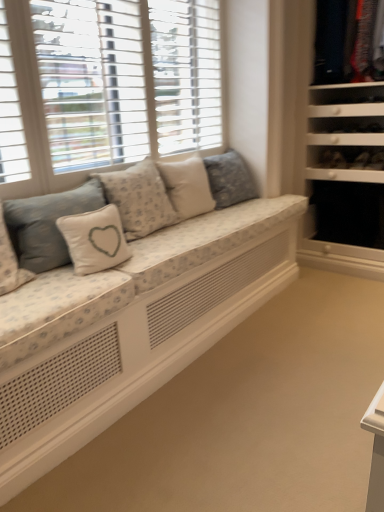
Describe the element at coordinates (139, 198) in the screenshot. Image resolution: width=384 pixels, height=512 pixels. I see `white fabric pillow at center, positioned as the 3th pillow in left-to-right order` at that location.

What do you see at coordinates (187, 186) in the screenshot?
I see `white fabric pillow at center, positioned as the fourth pillow in left-to-right order` at bounding box center [187, 186].

Where is `white textured shutters at upper left`? This screenshot has height=512, width=384. white textured shutters at upper left is located at coordinates (104, 87).

Image resolution: width=384 pixels, height=512 pixels. I want to click on fluffy white pillow at center, which is the first pillow from right to left, so click(x=229, y=179).

The height and width of the screenshot is (512, 384). Describe the element at coordinates (229, 179) in the screenshot. I see `fluffy white pillow at center, which is the first pillow from right to left` at that location.

This screenshot has height=512, width=384. I want to click on white fabric pillow with heart design at center, which is the second pillow in left-to-right order, so 94,239.

Is white textured shutters at upper left facing away from white fabric pillow with heart design at center, which is the second pillow in left-to-right order?

No, white textured shutters at upper left is not facing the opposite direction of white fabric pillow with heart design at center, which is the second pillow in left-to-right order.

Considering the relative sizes of white textured shutters at upper left and white fabric pillow with heart design at center, the 4th pillow in the right-to-left sequence, in the image provided, is white textured shutters at upper left taller than white fabric pillow with heart design at center, the 4th pillow in the right-to-left sequence,?

Yes.

Image resolution: width=384 pixels, height=512 pixels. I want to click on the 5th pillow located beneath the white textured shutters at upper left (from a real-world perspective), so 94,239.

Which of these two, white textured shutters at upper left or white fabric pillow with heart design at center, which is the second pillow in left-to-right order, is bigger?

white textured shutters at upper left is bigger.

Between point (65, 236) and point (362, 237), which one is positioned behind?

The point (362, 237) is behind.

Considering the relative sizes of white fabric pillow with heart design at center, the 4th pillow in the right-to-left sequence, and black fabric drawer at right in the image provided, is white fabric pillow with heart design at center, the 4th pillow in the right-to-left sequence, smaller than black fabric drawer at right?

Yes, white fabric pillow with heart design at center, the 4th pillow in the right-to-left sequence, is smaller than black fabric drawer at right.

Which of these two, white fabric pillow with heart design at center, which is the second pillow in left-to-right order, or black fabric drawer at right, stands taller?

Standing taller between the two is black fabric drawer at right.

Is white fabric pillow with heart design at center, which is the second pillow in left-to-right order, positioned before black fabric drawer at right?

Yes, white fabric pillow with heart design at center, which is the second pillow in left-to-right order, is closer to the camera.

Considering the sizes of white fabric pillow at center, arranged as the second pillow when viewed from the right, and black fabric drawer at right in the image, is white fabric pillow at center, arranged as the second pillow when viewed from the right, taller or shorter than black fabric drawer at right?

Considering their sizes, white fabric pillow at center, arranged as the second pillow when viewed from the right, has less height than black fabric drawer at right.

Considering the positions of objects white fabric pillow at center, positioned as the fourth pillow in left-to-right order, and black fabric drawer at right in the image provided, who is more to the right, white fabric pillow at center, positioned as the fourth pillow in left-to-right order, or black fabric drawer at right?

black fabric drawer at right.

Considering the positions of objects white fabric pillow at center, positioned as the fourth pillow in left-to-right order, and black fabric drawer at right in the image provided, who is behind, white fabric pillow at center, positioned as the fourth pillow in left-to-right order, or black fabric drawer at right?

black fabric drawer at right is more distant.

From the image's perspective, would you say white fabric pillow at center, arranged as the second pillow when viewed from the right, is shown under black fabric drawer at right?

Incorrect, from the image's perspective, white fabric pillow at center, arranged as the second pillow when viewed from the right, is higher than black fabric drawer at right.

Is fluffy white pillow at center, which is the first pillow from right to left, situated inside floral fabric studio couch at center or outside?

fluffy white pillow at center, which is the first pillow from right to left, is spatially situated outside floral fabric studio couch at center.

Is floral fabric studio couch at center at the back of fluffy white pillow at center, which is the first pillow from right to left?

fluffy white pillow at center, which is the first pillow from right to left, is not turned away from floral fabric studio couch at center.

Who is smaller, fluffy white pillow at center, the fifth pillow viewed from the left, or floral fabric studio couch at center?

Smaller between the two is fluffy white pillow at center, the fifth pillow viewed from the left.

From the image's perspective, who appears lower, fluffy white pillow at center, the fifth pillow viewed from the left, or floral fabric studio couch at center?

From the image's view, floral fabric studio couch at center is below.

Is the position of white textured shutters at upper left more distant than that of floral fabric studio couch at center?

Yes, white textured shutters at upper left is further from the viewer.

Is white textured shutters at upper left directly adjacent to floral fabric studio couch at center?

No, white textured shutters at upper left is not touching floral fabric studio couch at center.

Which is nearer, (109, 151) or (88, 285)?

Clearly, point (109, 151) is more distant from the camera than point (88, 285).

How different are the orientations of fluffy white pillow at center, the fifth pillow viewed from the left, and white fabric pillow at center, arranged as the second pillow when viewed from the right, in degrees?

1.08 degrees separate the facing orientations of fluffy white pillow at center, the fifth pillow viewed from the left, and white fabric pillow at center, arranged as the second pillow when viewed from the right.

Looking at this image, considering the relative sizes of fluffy white pillow at center, the fifth pillow viewed from the left, and white fabric pillow at center, arranged as the second pillow when viewed from the right, in the image provided, is fluffy white pillow at center, the fifth pillow viewed from the left, wider than white fabric pillow at center, arranged as the second pillow when viewed from the right,?

Yes.

Consider the image. Is fluffy white pillow at center, the fifth pillow viewed from the left, not inside white fabric pillow at center, arranged as the second pillow when viewed from the right?

Absolutely, fluffy white pillow at center, the fifth pillow viewed from the left, is external to white fabric pillow at center, arranged as the second pillow when viewed from the right.

Is floral fabric studio couch at center in front of or behind fluffy white pillow at center, which is the first pillow from right to left, in the image?

In the image, floral fabric studio couch at center appears in front of fluffy white pillow at center, which is the first pillow from right to left.

Considering the relative positions of floral fabric studio couch at center and fluffy white pillow at center, the fifth pillow viewed from the left, in the image provided, is floral fabric studio couch at center to the right of fluffy white pillow at center, the fifth pillow viewed from the left, from the viewer's perspective?

Yes, floral fabric studio couch at center is to the right of fluffy white pillow at center, the fifth pillow viewed from the left.

From the image's perspective, starting from the floral fabric studio couch at center, which pillow is the 5th one above? Please provide its 2D coordinates.

[(229, 179)]

This screenshot has height=512, width=384. What are the coordinates of `the 5th pillow positioned below the white textured shutters at upper left (from the image's perspective)` in the screenshot? It's located at (94, 239).

I want to click on shelf on the right of white fabric pillow with heart design at center, the 4th pillow in the right-to-left sequence, so click(x=349, y=213).

Based on their spatial positions, is fluffy white pillow at center, the fifth pillow viewed from the left, or black fabric drawer at right closer to floral fabric studio couch at center?

Based on the image, fluffy white pillow at center, the fifth pillow viewed from the left, appears to be nearer to floral fabric studio couch at center.

Consider the image. When comparing their distances from white textured shutters at upper left, does white fabric pillow with heart design at center, which is the 5th pillow in right-to-left order, or fluffy white pillow at center, which is the first pillow from right to left, seem further?

Based on the image, fluffy white pillow at center, which is the first pillow from right to left, appears to be further to white textured shutters at upper left.

Which object lies further to the anchor point white fabric pillow with heart design at center, placed as the 1th pillow when sorted from left to right, fluffy white pillow at center, the fifth pillow viewed from the left, or white fabric pillow at center, arranged as the second pillow when viewed from the right?

fluffy white pillow at center, the fifth pillow viewed from the left, is further to white fabric pillow with heart design at center, placed as the 1th pillow when sorted from left to right.

Looking at the image, which one is located closer to white fabric pillow with heart design at center, placed as the 1th pillow when sorted from left to right, floral fabric studio couch at center or fluffy white pillow at center, which is the first pillow from right to left?

floral fabric studio couch at center is closer to white fabric pillow with heart design at center, placed as the 1th pillow when sorted from left to right.

When comparing their distances from white fabric pillow at center, positioned as the fourth pillow in left-to-right order, does white fabric pillow at center, positioned as the 3th pillow in left-to-right order, or black fabric drawer at right seem closer?

Based on the image, white fabric pillow at center, positioned as the 3th pillow in left-to-right order, appears to be nearer to white fabric pillow at center, positioned as the fourth pillow in left-to-right order.

Estimate the real-world distances between objects in this image. Which object is closer to white textured shutters at upper left, white fabric pillow at center, positioned as the 3th pillow in left-to-right order, or black fabric drawer at right?

white fabric pillow at center, positioned as the 3th pillow in left-to-right order.

When comparing their distances from floral fabric studio couch at center, does white fabric pillow with heart design at center, which is the second pillow in left-to-right order, or white fabric pillow at center, arranged as the second pillow when viewed from the right, seem further?

white fabric pillow at center, arranged as the second pillow when viewed from the right.

Considering their positions, is white fabric pillow with heart design at center, the 4th pillow in the right-to-left sequence, positioned further to white fabric pillow at center, the third pillow positioned from the right, than floral fabric studio couch at center?

white fabric pillow with heart design at center, the 4th pillow in the right-to-left sequence, lies further to white fabric pillow at center, the third pillow positioned from the right, than the other object.

This screenshot has width=384, height=512. In order to click on window positioned between floral fabric studio couch at center and fluffy white pillow at center, which is the first pillow from right to left, from near to far in this screenshot , I will do `click(104, 87)`.

Where is `pillow between white fabric pillow at center, positioned as the 3th pillow in left-to-right order, and fluffy white pillow at center, which is the first pillow from right to left, in the front-back direction`? The image size is (384, 512). pillow between white fabric pillow at center, positioned as the 3th pillow in left-to-right order, and fluffy white pillow at center, which is the first pillow from right to left, in the front-back direction is located at coordinates (187, 186).

Where is `pillow situated between white fabric pillow at center, arranged as the second pillow when viewed from the right, and black fabric drawer at right from left to right`? The image size is (384, 512). pillow situated between white fabric pillow at center, arranged as the second pillow when viewed from the right, and black fabric drawer at right from left to right is located at coordinates (229, 179).

In order to click on pillow between white fabric pillow with heart design at center, which is the second pillow in left-to-right order, and white fabric pillow at center, positioned as the fourth pillow in left-to-right order, in the front-back direction in this screenshot , I will do [139, 198].